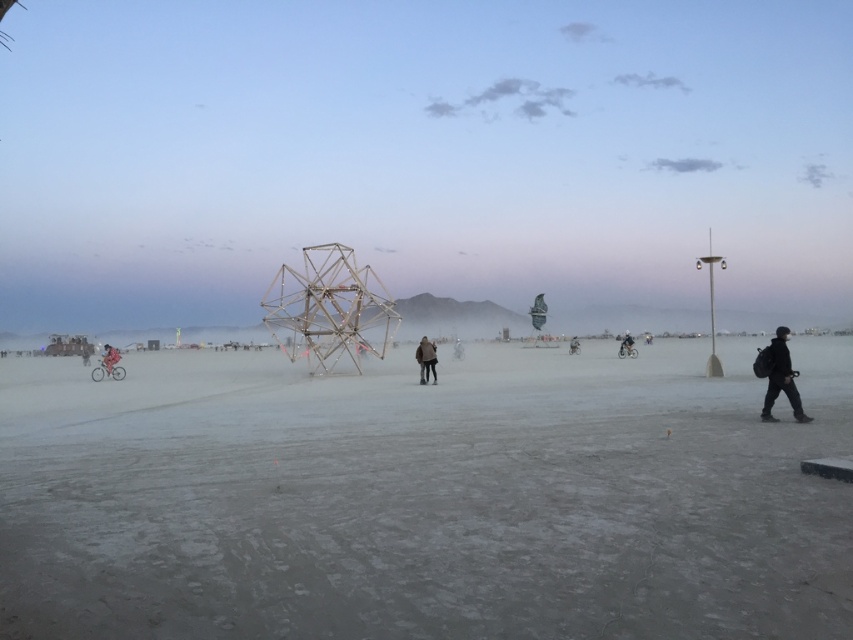
Who is shorter, brown leather jacket at center or brushed metal bicycle at left?

With less height is brushed metal bicycle at left.

Which is in front, point (416, 349) or point (109, 348)?

Point (416, 349)

Locate an element on the screen. The width and height of the screenshot is (853, 640). brown leather jacket at center is located at coordinates (426, 358).

Does metallic structure at center lie in front of black matte jacket at right?

No, metallic structure at center is behind black matte jacket at right.

Is metallic structure at center taller than black matte jacket at right?

Yes.

Find the location of a particular element. The width and height of the screenshot is (853, 640). metallic structure at center is located at coordinates (329, 308).

What are the coordinates of `metallic structure at center` in the screenshot? It's located at (329, 308).

Does gray sand at center have a greater height compared to brushed metal bicycle at left?

In fact, gray sand at center may be shorter than brushed metal bicycle at left.

Is point (131, 419) positioned in front of point (112, 360)?

Yes.

Image resolution: width=853 pixels, height=640 pixels. I want to click on gray sand at center, so pos(422,499).